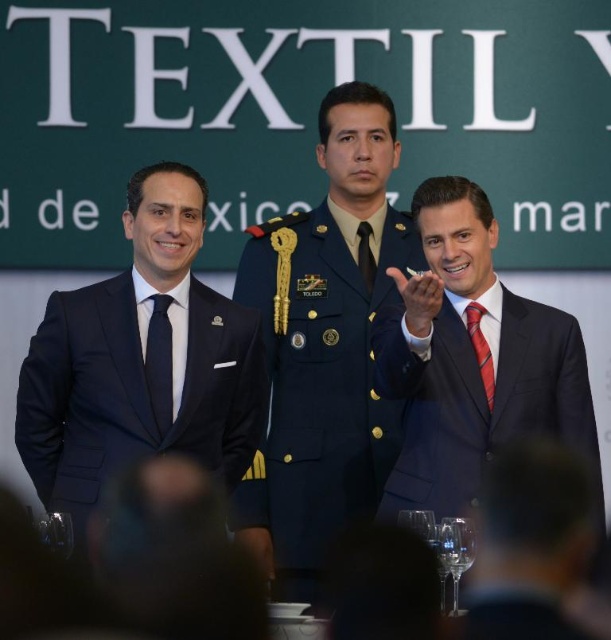
From the picture: You are organizing a photo shoot and need to ensure that all attire details are visible. Given that the shiny dark suit at right and the red striped tie at right are both important elements, which one is larger in size to better highlight in the photograph?

The shiny dark suit at right is bigger than the red striped tie at right, so it is larger and should be better highlighted in the photograph.

You are a photographer positioned at the center of the stage, and you want to take a photo of the navy blue suit at left and the shiny dark suit at right. Given that your camera has a maximum focus range of 8 meters, will you be able to capture both subjects clearly in the same frame?

The distance between the navy blue suit at left and the shiny dark suit at right is 9.12 meters, which exceeds the camera maximum focus range of 8 meters. Therefore, you cannot capture both subjects clearly in the same frame.

From the picture: You are a photographer adjusting your camera to focus on two specific points in the image. The first point is at coordinates point (185,419) and the second is at point (378,312). Which point should you focus on first if you want to ensure the closest object is in sharp focus?

Point (185,419) is closer to the camera than point (378,312), so you should focus on point (185,419) first to ensure the closest object is in sharp focus.